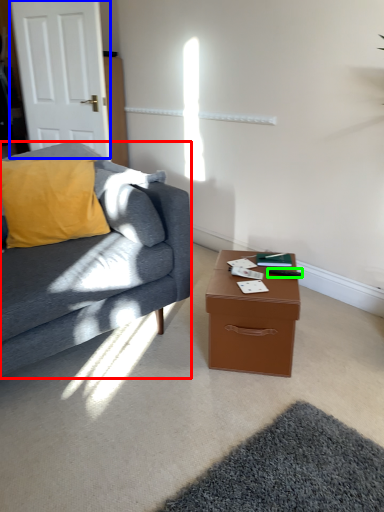
Question: Which is nearer to the studio couch (highlighted by a red box)? door (highlighted by a blue box) or remote control (highlighted by a green box).

Choices:
 (A) door
 (B) remote control

Answer: (B)